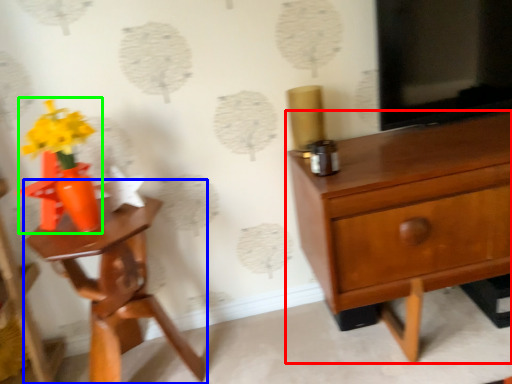
Question: Estimate the real-world distances between objects in this image. Which object is farther from chest of drawers (highlighted by a red box), nightstand (highlighted by a blue box) or floral arrangement (highlighted by a green box)?

Choices:
 (A) nightstand
 (B) floral arrangement

Answer: (B)